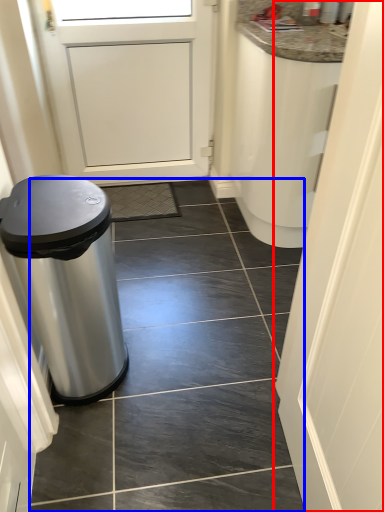
Question: Which point is further to the camera, door (highlighted by a red box) or tile (highlighted by a blue box)?

Choices:
 (A) door
 (B) tile

Answer: (B)